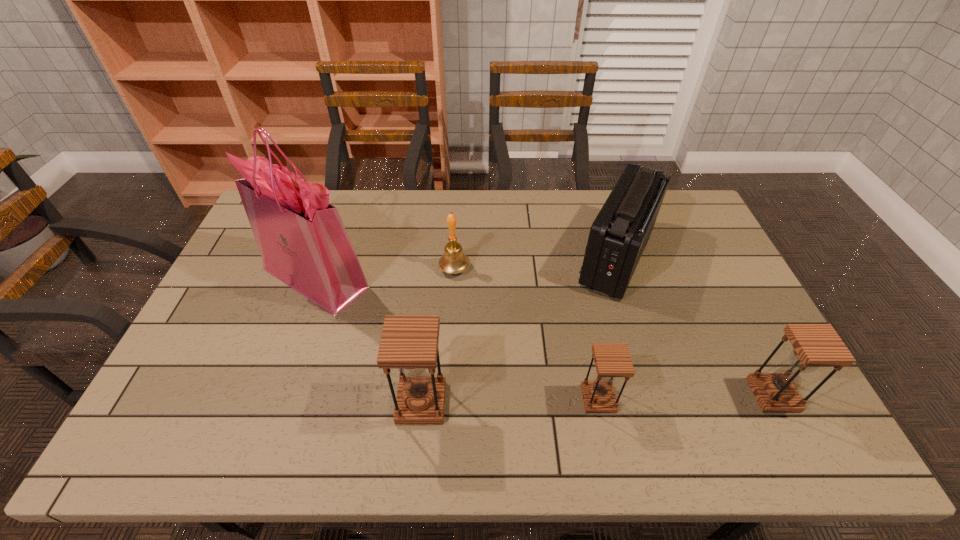
At what (x,y) coordinates should I click in order to perform the action: click on unoccupied position between the shortest object and the radio receiver. Please return your answer as a coordinate pair (x, y). The height and width of the screenshot is (540, 960). Looking at the image, I should click on (608, 328).

Select which object is the second closest to the leftmost hourglass. Please provide its 2D coordinates. Your answer should be formatted as a tuple, i.e. [(x, y)], where the tuple contains the x and y coordinates of a point satisfying the conditions above.

[(612, 360)]

Find the location of a particular element. The image size is (960, 540). object that is the closest one to the second hourglass from right to left is located at coordinates [x=618, y=236].

You are a GUI agent. You are given a task and a screenshot of the screen. Output one action in this format:
    pyautogui.click(x=<x>, y=<y>)
    Task: Click on the hourglass that can be found as the closest to the second tallest hourglass
    
    Given the screenshot: What is the action you would take?
    pyautogui.click(x=612, y=360)

Find the location of a particular element. The width and height of the screenshot is (960, 540). the third closest hourglass relative to the bell is located at coordinates (814, 345).

Locate an element on the screen. The width and height of the screenshot is (960, 540). vacant space that satisfies the following two spatial constraints: 1. on the front panel of the rightmost hourglass; 2. on the left side of the radio receiver is located at coordinates (660, 395).

In order to click on blank area in the image that satisfies the following two spatial constraints: 1. on the back side of the leftmost hourglass; 2. on the left side of the bell in this screenshot , I will do `click(435, 268)`.

Find the location of a particular element. Image resolution: width=960 pixels, height=540 pixels. vacant position in the image that satisfies the following two spatial constraints: 1. on the front panel of the radio receiver; 2. on the front side of the leftmost object is located at coordinates (623, 278).

Find the location of a particular element. This screenshot has height=540, width=960. free spot that satisfies the following two spatial constraints: 1. on the front side of the shortest object; 2. on the left side of the bell is located at coordinates (447, 399).